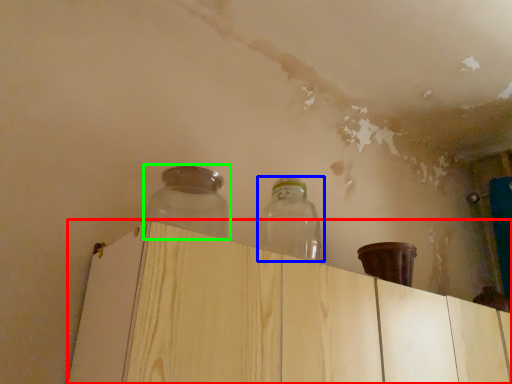
Question: Based on their relative distances, which object is nearer to dresser (highlighted by a red box)? Choose from bottle (highlighted by a blue box) and bottle (highlighted by a green box).

Choices:
 (A) bottle
 (B) bottle

Answer: (B)